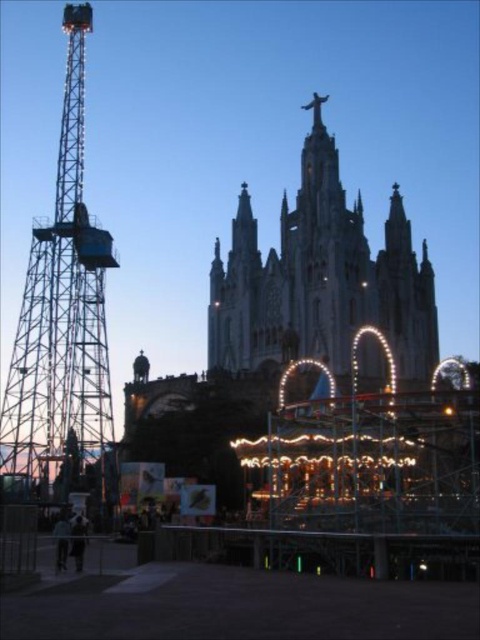
Does point (421, 305) lie in front of point (83, 364)?

No, it is not.

Does point (288, 236) come in front of point (62, 164)?

No.

Find the location of a particular element. stone cathedral at center is located at coordinates (321, 278).